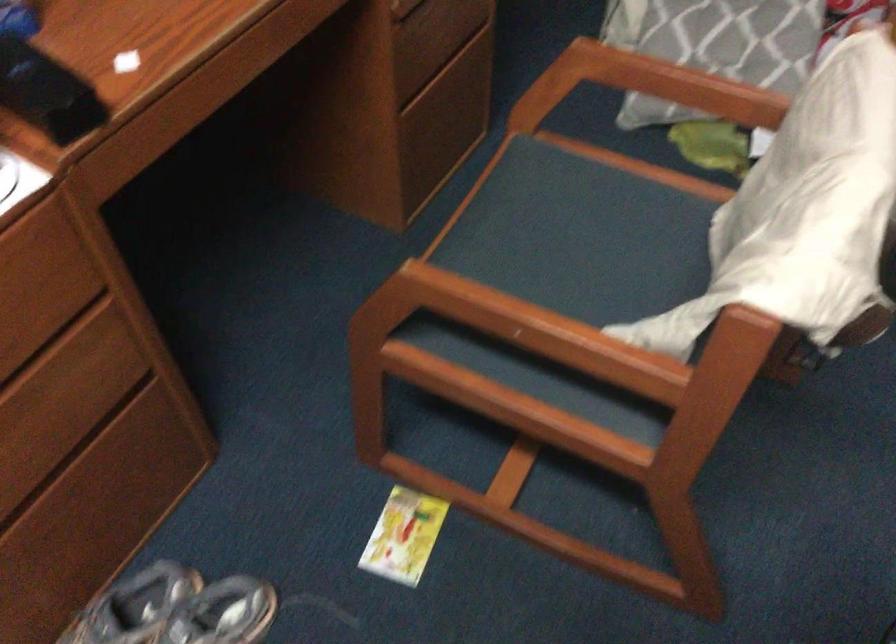
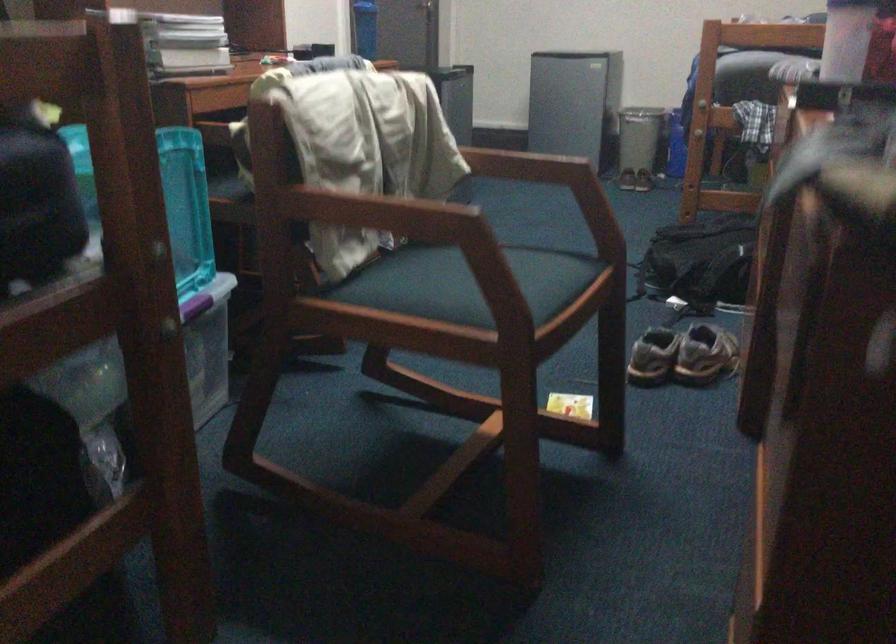
Find the pixel in the second image that matches point (199, 574) in the first image.

(682, 355)